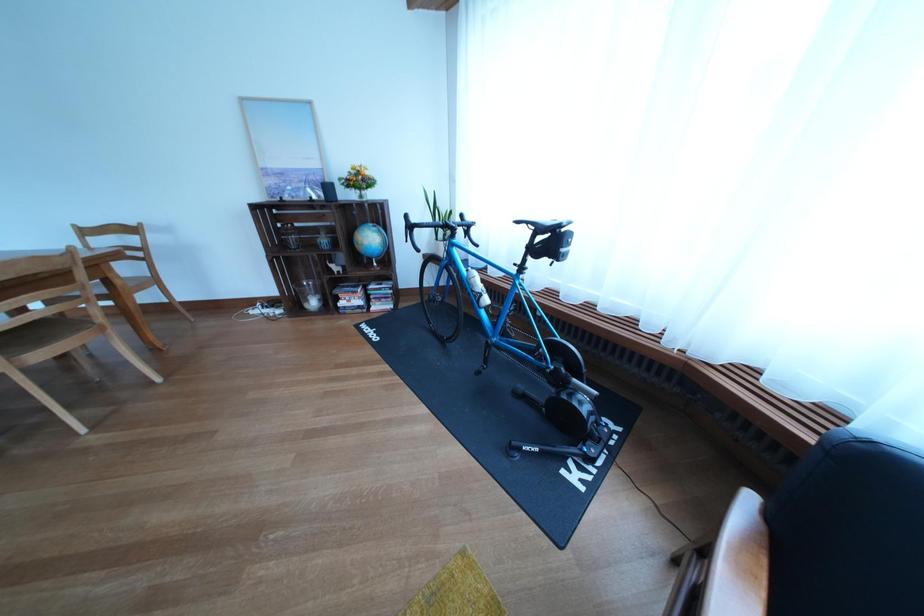
Locate an element on the screen. stack of books is located at coordinates (365, 297).